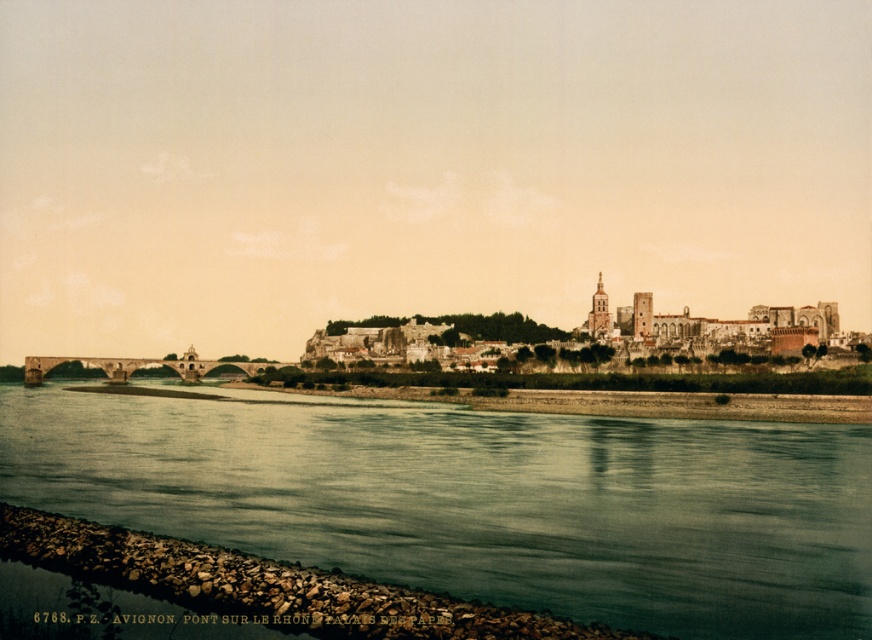
Between brown/smooth river at lower center and brown stone buildings at center, which one has more height?

brown stone buildings at center

Can you confirm if brown/smooth river at lower center is bigger than brown stone buildings at center?

Indeed, brown/smooth river at lower center has a larger size compared to brown stone buildings at center.

Describe the element at coordinates (479, 499) in the screenshot. I see `brown/smooth river at lower center` at that location.

The height and width of the screenshot is (640, 872). Identify the location of brown/smooth river at lower center. (479, 499).